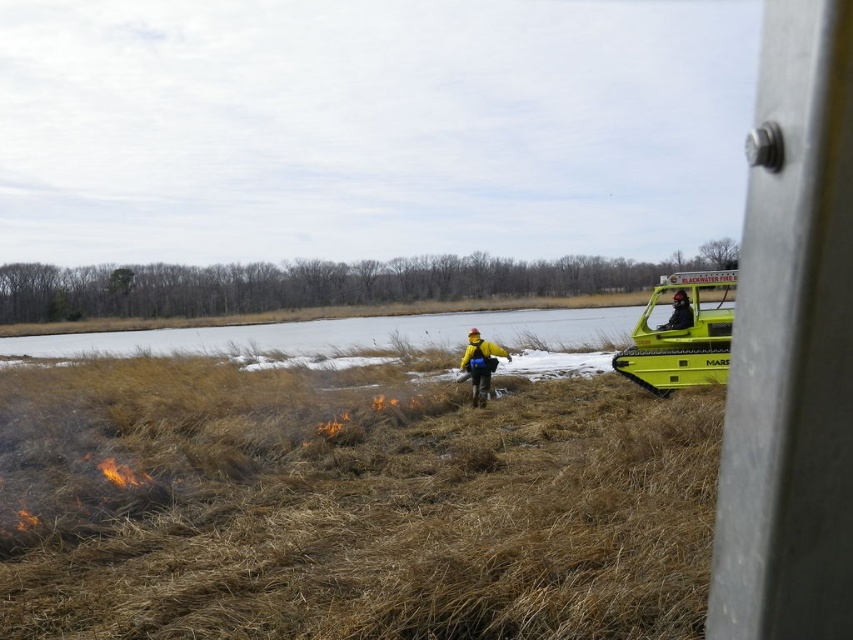
Question: Does yellow matte jacket at center appear on the left side of black matte helmet at center?

Choices:
 (A) yes
 (B) no

Answer: (A)

Question: Estimate the real-world distances between objects in this image. Which object is farther from the black matte helmet at center?

Choices:
 (A) yellow matte jacket at center
 (B) brown dry grass at center

Answer: (B)

Question: Which point appears farthest from the camera in this image?

Choices:
 (A) click(x=482, y=396)
 (B) click(x=421, y=436)

Answer: (A)

Question: Can you confirm if brown dry grass at center is smaller than black matte helmet at center?

Choices:
 (A) no
 (B) yes

Answer: (A)

Question: Can you confirm if brown dry grass at center is wider than yellow matte jacket at center?

Choices:
 (A) no
 (B) yes

Answer: (B)

Question: Among these points, which one is nearest to the camera?

Choices:
 (A) (144, 451)
 (B) (677, 308)

Answer: (A)